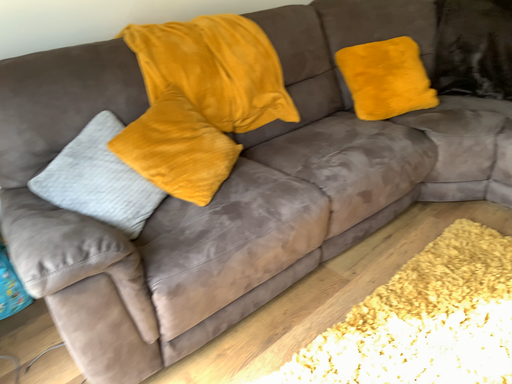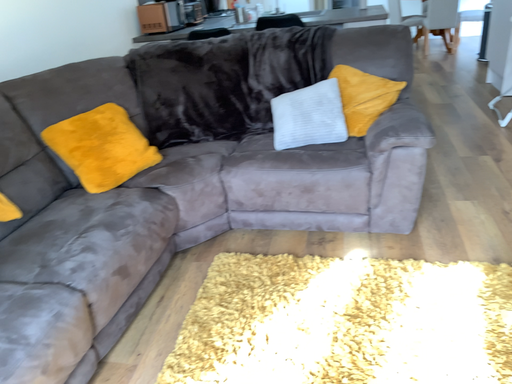
Question: How did the camera likely rotate when shooting the video?

Choices:
 (A) rotated left
 (B) rotated right

Answer: (B)